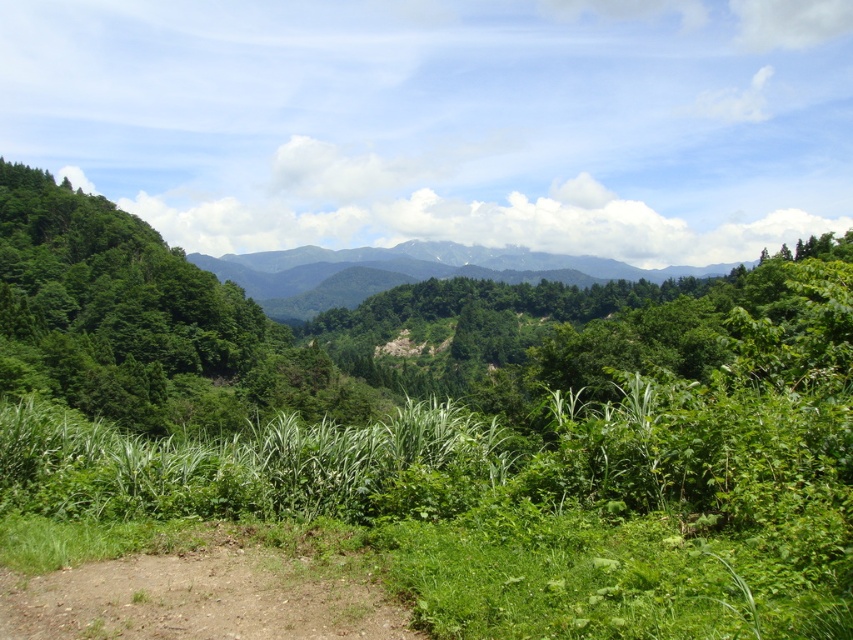
Question: Which is nearer to the green leafy tree at left?

Choices:
 (A) green forested mountain at center
 (B) brown dirt track at lower left

Answer: (B)

Question: Is brown dirt track at lower left to the right of green forested mountain at center from the viewer's perspective?

Choices:
 (A) yes
 (B) no

Answer: (B)

Question: Based on their relative distances, which object is farther from the green leafy tree at left?

Choices:
 (A) green forested mountain at center
 (B) brown dirt track at lower left

Answer: (A)

Question: Can you confirm if green leafy tree at left is positioned above brown dirt track at lower left?

Choices:
 (A) yes
 (B) no

Answer: (A)

Question: Does brown dirt track at lower left have a lesser width compared to green forested mountain at center?

Choices:
 (A) yes
 (B) no

Answer: (A)

Question: Based on their relative distances, which object is nearer to the green forested mountain at center?

Choices:
 (A) green leafy tree at left
 (B) brown dirt track at lower left

Answer: (A)